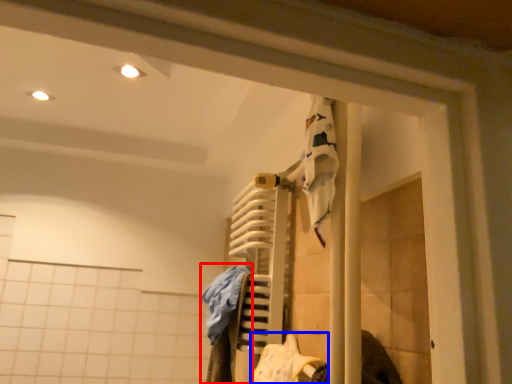
Question: Which of the following is the closest to the observer, clothing (highlighted by a red box) or clothing (highlighted by a blue box)?

Choices:
 (A) clothing
 (B) clothing

Answer: (B)